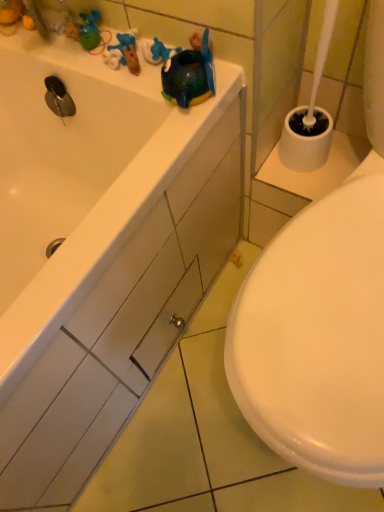
What do you see at coordinates (140, 310) in the screenshot?
I see `white glossy drawer at center` at bounding box center [140, 310].

Identify the location of white glossy drawer at center. The width and height of the screenshot is (384, 512). [x=140, y=310].

The height and width of the screenshot is (512, 384). What are the coordinates of `white glossy bathtub at upper left` in the screenshot? It's located at (99, 250).

This screenshot has height=512, width=384. Describe the element at coordinates (99, 250) in the screenshot. I see `white glossy bathtub at upper left` at that location.

This screenshot has width=384, height=512. I want to click on white glossy drawer at center, so click(140, 310).

Which object is positioned more to the right, white glossy bathtub at upper left or white glossy drawer at center?

From the viewer's perspective, white glossy drawer at center appears more on the right side.

Is white glossy bathtub at upper left positioned before white glossy drawer at center?

Yes, it is in front of white glossy drawer at center.

Which point is more forward, (132, 292) or (119, 351)?

The point (132, 292) is in front.

From the image's perspective, between white glossy bathtub at upper left and white glossy drawer at center, which one is located above?

From the image's view, white glossy bathtub at upper left is above.

From a real-world perspective, which object rests below the other?

white glossy drawer at center is physically lower.

Considering the relative sizes of white glossy bathtub at upper left and white glossy drawer at center in the image provided, is white glossy bathtub at upper left wider than white glossy drawer at center?

Indeed, white glossy bathtub at upper left has a greater width compared to white glossy drawer at center.

Does white glossy bathtub at upper left have a lesser height compared to white glossy drawer at center?

In fact, white glossy bathtub at upper left may be taller than white glossy drawer at center.

Does white glossy bathtub at upper left have a smaller size compared to white glossy drawer at center?

No, white glossy bathtub at upper left is not smaller than white glossy drawer at center.

Is white glossy bathtub at upper left outside of white glossy drawer at center?

Yes.

Consider the image. Is white glossy bathtub at upper left next to white glossy drawer at center?

No, white glossy bathtub at upper left is not in contact with white glossy drawer at center.

Is white glossy bathtub at upper left facing towards white glossy drawer at center?

Yes, white glossy bathtub at upper left is oriented towards white glossy drawer at center.

Can you tell me how much white glossy bathtub at upper left and white glossy drawer at center differ in facing direction?

They differ by 0.032 degrees in their facing directions.

Locate an element on the screen. bathtub above the white glossy drawer at center (from a real-world perspective) is located at coordinates (99, 250).

Looking at this image, is white glossy drawer at center to the right of white glossy bathtub at upper left from the viewer's perspective?

Yes, white glossy drawer at center is to the right of white glossy bathtub at upper left.

Which is in front, white glossy drawer at center or white glossy bathtub at upper left?

white glossy bathtub at upper left is closer to the camera.

Is point (113, 356) positioned after point (145, 246)?

Yes, it is behind point (145, 246).

From the image's perspective, which one is positioned lower, white glossy drawer at center or white glossy bathtub at upper left?

white glossy drawer at center is shown below in the image.

Consider the image. From a real-world perspective, which is physically above, white glossy drawer at center or white glossy bathtub at upper left?

white glossy bathtub at upper left.

Based on the photo, is white glossy drawer at center wider or thinner than white glossy bathtub at upper left?

In the image, white glossy drawer at center appears to be more narrow than white glossy bathtub at upper left.

From the picture: Does white glossy drawer at center have a lesser height compared to white glossy bathtub at upper left?

Yes.

Based on the photo, can you confirm if white glossy drawer at center is smaller than white glossy bathtub at upper left?

Correct, white glossy drawer at center occupies less space than white glossy bathtub at upper left.

Is white glossy bathtub at upper left completely or partially inside white glossy drawer at center?

Actually, white glossy bathtub at upper left is outside white glossy drawer at center.

Is white glossy drawer at center positioned far away from white glossy bathtub at upper left?

They are positioned close to each other.

From the picture: Is white glossy drawer at center facing towards white glossy bathtub at upper left?

Yes.

How many degrees apart are the facing directions of white glossy drawer at center and white glossy bathtub at upper left?

0.032 degrees.

You are a GUI agent. You are given a task and a screenshot of the screen. Output one action in this format:
    pyautogui.click(x=<x>, y=<y>)
    Task: Click on the bathtub above the white glossy drawer at center (from a real-world perspective)
    The height and width of the screenshot is (512, 384).
    Given the screenshot: What is the action you would take?
    [x=99, y=250]

Find the location of a particular element. This screenshot has width=384, height=512. bathtub in front of the white glossy drawer at center is located at coordinates (99, 250).

The image size is (384, 512). Identify the location of bathtub above the white glossy drawer at center (from a real-world perspective). (99, 250).